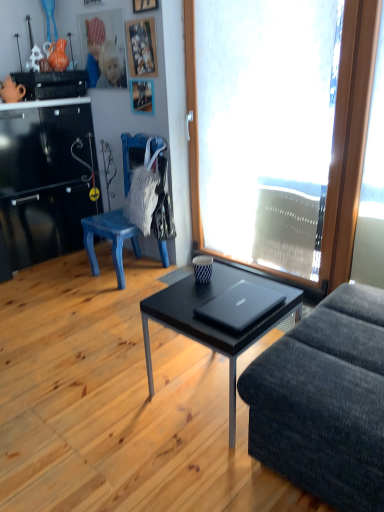
Identify the location of free space to the back side of black matte laptop at center. This screenshot has width=384, height=512. (224, 282).